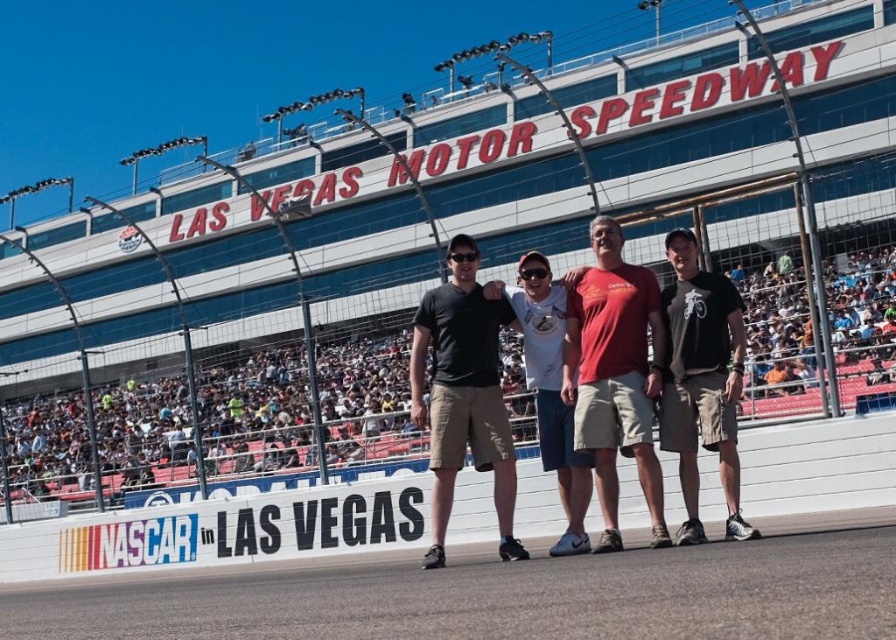
Consider the image. You are standing at the Las Vegas Motor Speedway and want to find the point located at coordinates (498, 596). Based on the scene description, where would this point be in relation to the gray asphalt dirt track at lower center?

The point at (498, 596) is on the gray asphalt dirt track at lower center.

You are standing at the point labeled as point (496, 484) at Las Vegas Motor Speedway. The grandstand with the event signage is behind you. If you walk straight ahead, will you eventually see the grandstand or the racetrack?

Since the grandstand is in the background and you are facing away from it while standing at point (496, 484), walking straight ahead would take you away from the grandstand. The racetrack is in the foreground where the four individuals are standing, so you would continue along the racetrack.